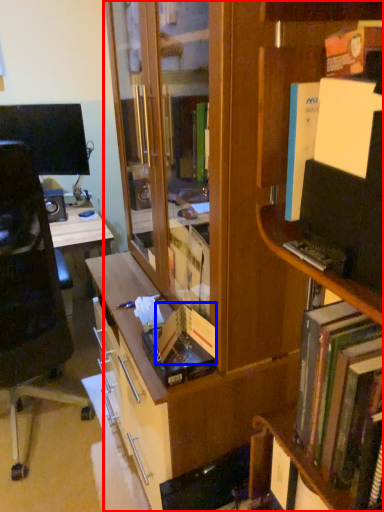
Question: Among these objects, which one is nearest to the camera, bookcase (highlighted by a red box) or paperback book (highlighted by a blue box)?

Choices:
 (A) bookcase
 (B) paperback book

Answer: (A)